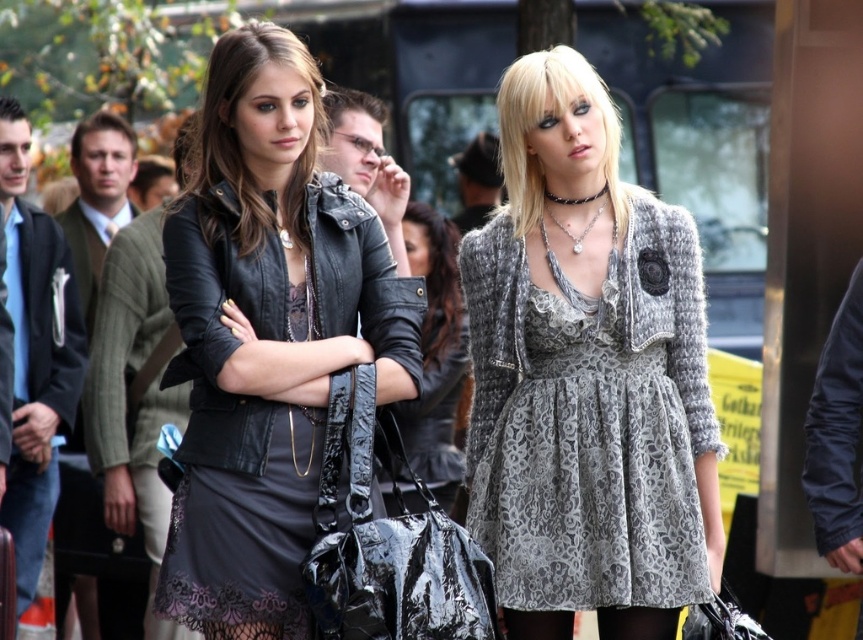
Question: Which object is the closest to the gray lace dress at center?

Choices:
 (A) black leather jacket at center
 (B) leather jacket at center

Answer: (A)

Question: Does gray lace dress at center have a greater width compared to leather jacket at center?

Choices:
 (A) no
 (B) yes

Answer: (B)

Question: Which point is closer to the camera?

Choices:
 (A) gray lace dress at center
 (B) black leather jacket at center

Answer: (B)

Question: Is black leather jacket at center smaller than gray lace dress at center?

Choices:
 (A) yes
 (B) no

Answer: (B)

Question: From the image, what is the correct spatial relationship of gray lace dress at center in relation to leather jacket at center?

Choices:
 (A) above
 (B) below

Answer: (B)

Question: Which object is positioned farthest from the black leather jacket at center?

Choices:
 (A) leather jacket at center
 (B) gray lace dress at center

Answer: (A)